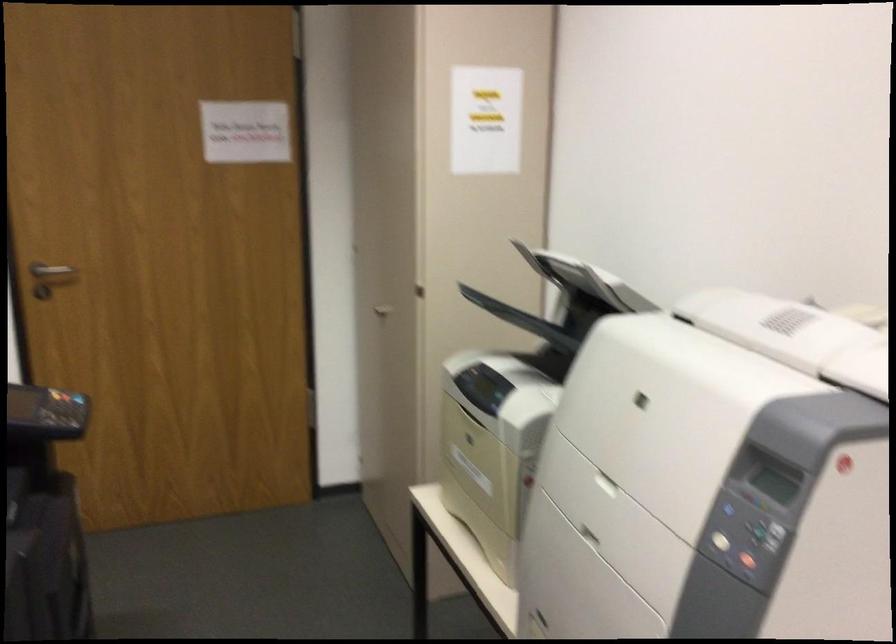
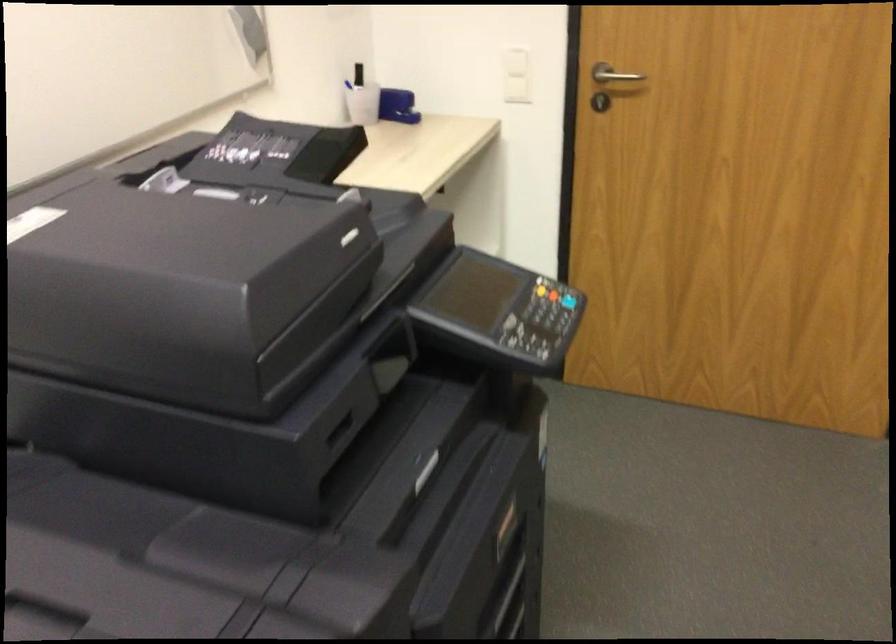
Based on the continuous images, in which direction is the camera rotating?

The rotation direction of the camera is left-down.